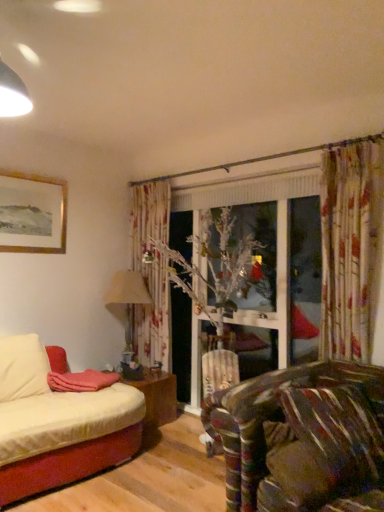
Question: Does point (172, 400) appear closer or farther from the camera than point (56, 200)?

Choices:
 (A) closer
 (B) farther

Answer: (B)

Question: Choose the correct answer: Is wooden table at lower left inside gold-framed painting at upper left or outside it?

Choices:
 (A) outside
 (B) inside

Answer: (A)

Question: Estimate the real-world distances between objects in this image. Which object is closer to the velvet brown pillow at lower right, marked as the first pillow in a right-to-left arrangement?

Choices:
 (A) wooden table at lower left
 (B) beige fabric lampshade at center
 (C) brown textured pillow at lower right, acting as the first pillow starting from the left
 (D) gold-framed painting at upper left
 (E) pink soft blanket at lower left

Answer: (C)

Question: Estimate the real-world distances between objects in this image. Which object is closer to the velvet brown pillow at lower right, the 2th pillow positioned from the left?

Choices:
 (A) beige fabric lampshade at center
 (B) pink soft blanket at lower left
 (C) gold-framed painting at upper left
 (D) brown textured pillow at lower right, acting as the first pillow starting from the left
 (E) wooden table at lower left

Answer: (D)